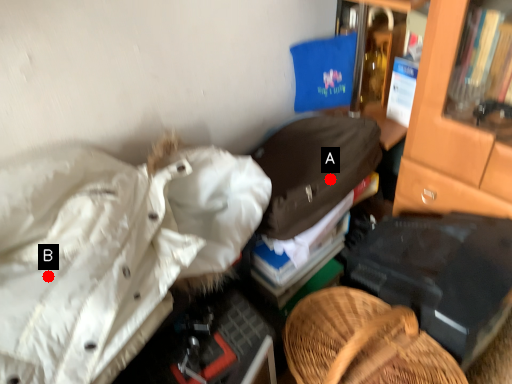
Question: Two points are circled on the image, labeled by A and B beside each circle. Which point is further to the camera?

Choices:
 (A) A is further
 (B) B is further

Answer: (A)